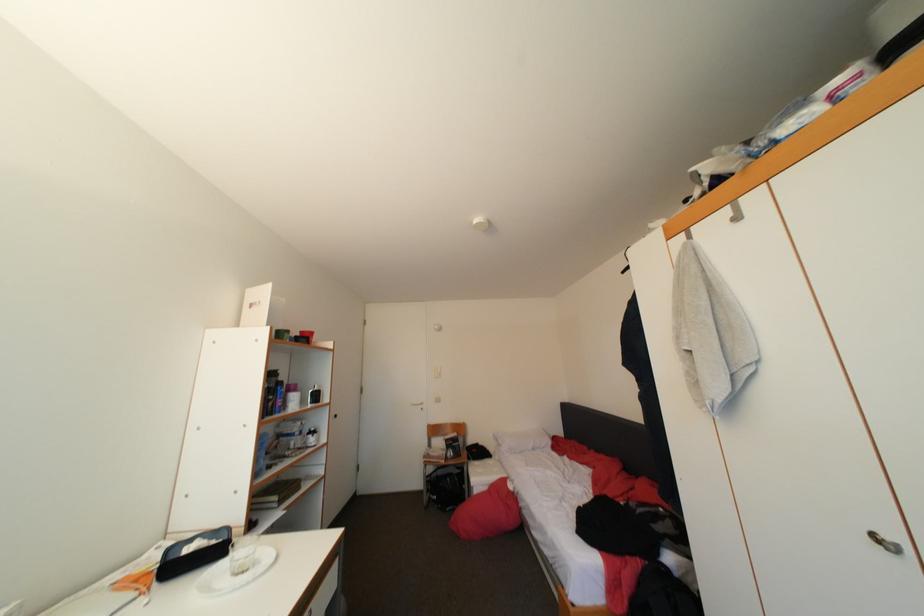
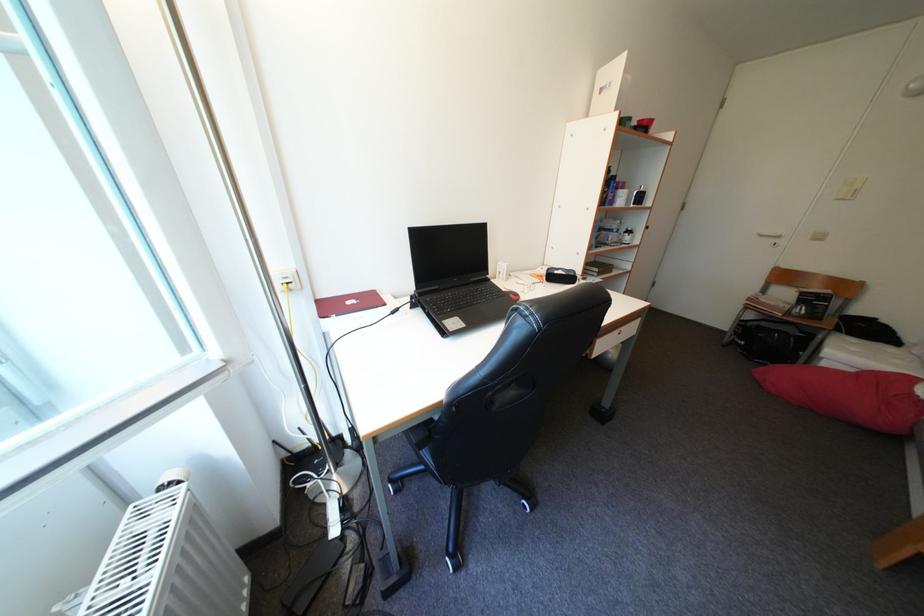
The images are taken continuously from a first-person perspective. In which direction is your viewpoint rotating?

The camera's rotation is toward left-down.